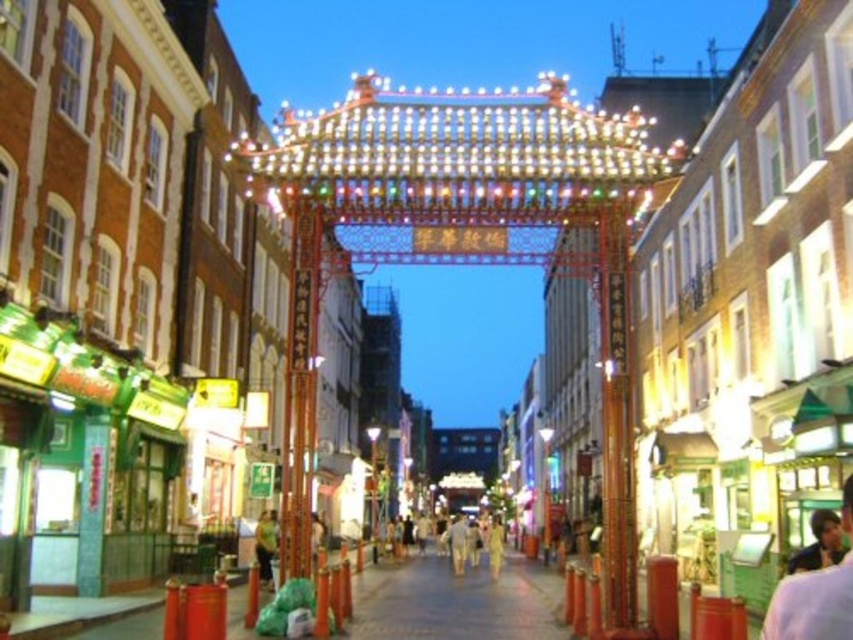
You are standing in the street scene and want to check your outfit. Which item is positioned higher on your body between the light brown leather jacket at lower right and the light beige cotton pants at center?

The light brown leather jacket at lower right is positioned higher on the body than the light beige cotton pants at center.

You are a photographer standing in front of the red archway and see two pairs of light beige pants at center and light beige cotton pants at center. Which pair is closer to you?

The light beige pants at center is closer to the viewer than the light beige cotton pants at center.